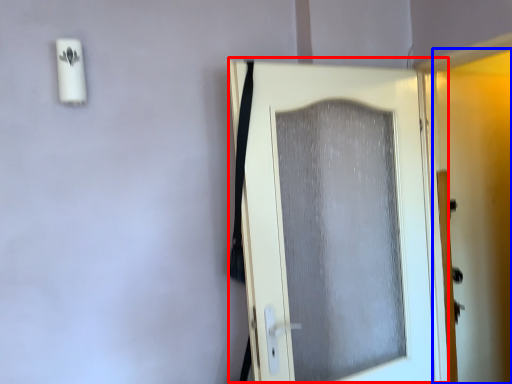
Question: Which point is closer to the camera, door (highlighted by a red box) or screen door (highlighted by a blue box)?

Choices:
 (A) door
 (B) screen door

Answer: (A)